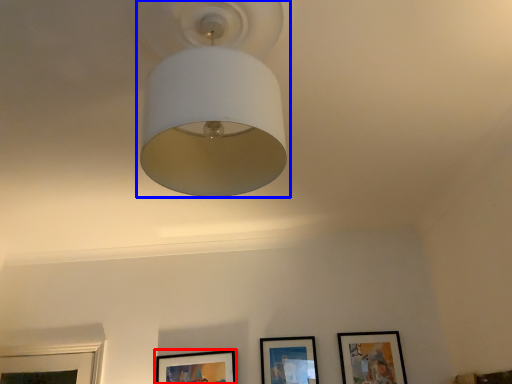
Question: Which point is closer to the camera, picture frame (highlighted by a red box) or lamp (highlighted by a blue box)?

Choices:
 (A) picture frame
 (B) lamp

Answer: (B)